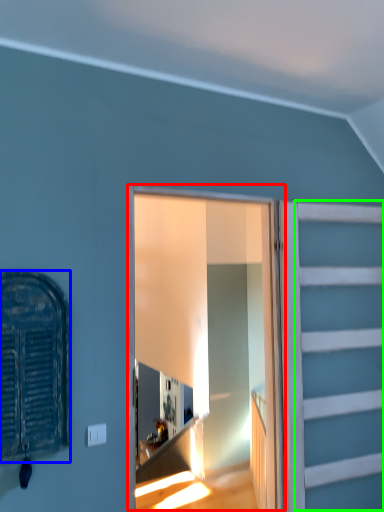
Question: Based on their relative distances, which object is nearer to window frame (highlighted by a red box)? Choose from window (highlighted by a blue box) and garage door (highlighted by a green box).

Choices:
 (A) window
 (B) garage door

Answer: (B)